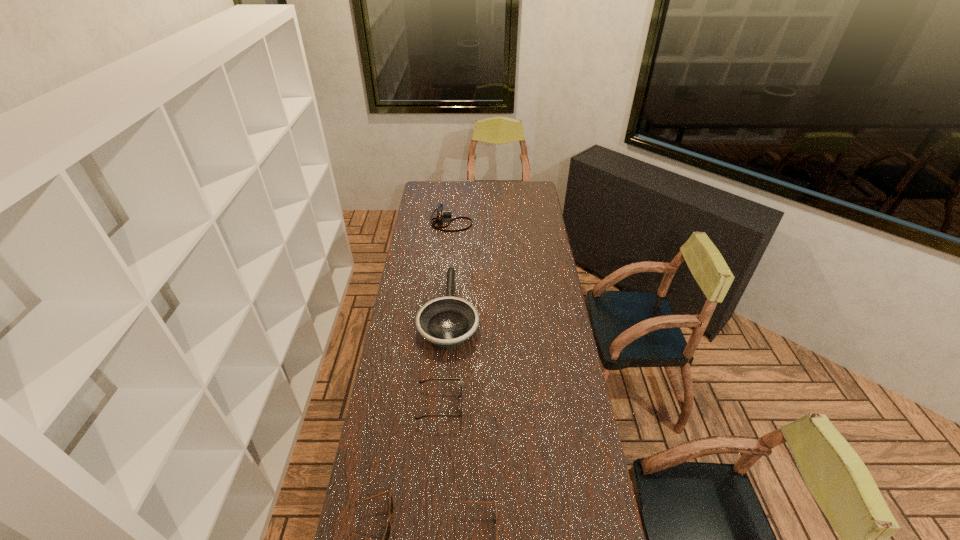
Image resolution: width=960 pixels, height=540 pixels. I want to click on the farthest object, so (x=441, y=213).

The height and width of the screenshot is (540, 960). I want to click on frying pan, so click(x=448, y=321).

Identify the location of the third nearest object. (420, 382).

This screenshot has height=540, width=960. I want to click on vacant region located 0.270m on the front-facing side of the farthest object, so click(520, 222).

At what (x,y) coordinates should I click in order to perform the action: click on vacant space positioned on the handle side of the frying pan. Please return your answer as a coordinate pair (x, y). The image size is (960, 540). Looking at the image, I should click on (453, 253).

At what (x,y) coordinates should I click in order to perform the action: click on vacant space located on the handle side of the frying pan. Please return your answer as a coordinate pair (x, y). Looking at the image, I should click on (455, 234).

What are the coordinates of `free space located 0.250m on the handle side of the frying pan` in the screenshot? It's located at (454, 245).

Where is `free region located 0.240m on the front lenses of the third farthest object`? Image resolution: width=960 pixels, height=540 pixels. free region located 0.240m on the front lenses of the third farthest object is located at coordinates (527, 404).

Locate an element on the screen. The width and height of the screenshot is (960, 540). camera that is at the left edge is located at coordinates (441, 213).

The image size is (960, 540). Find the location of `frying pan located at the left edge`. frying pan located at the left edge is located at coordinates (448, 321).